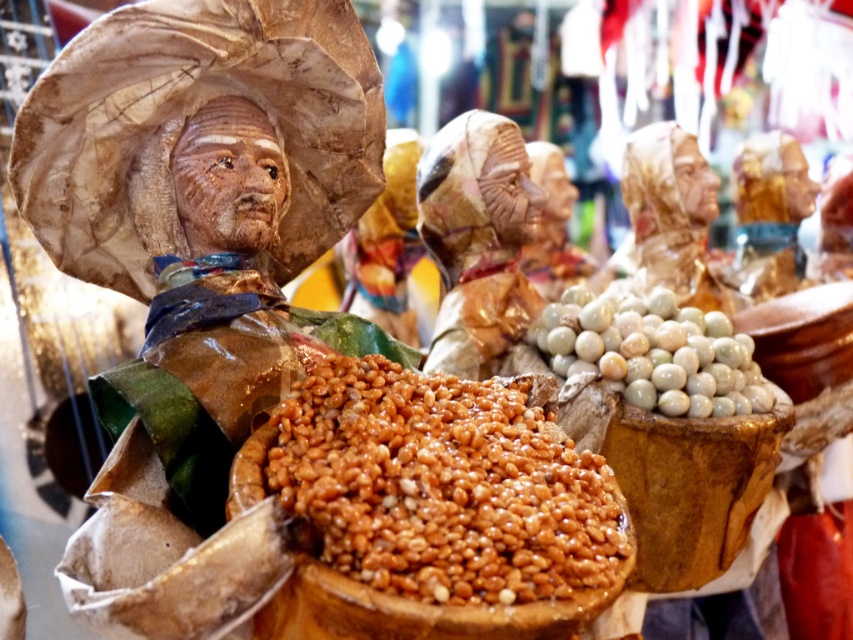
You are organizing a craft fair and have two items to display next to each other. You have a brown glossy grain at center and white marble beads at center. If you want to arrange them so that the larger item is on the left, which item should you place on the left?

The brown glossy grain at center is bigger than the white marble beads at center, so you should place the brown glossy grain at center on the left to have the larger item there.

You are standing in front of the vibrant display of traditional figurines. There is a point marked at coordinates (477, 237). What object is located at that point?

The point at coordinates (477, 237) is occupied by the matte brown statue at center.

You are standing in front of the display of traditional figurines. There are two points marked on the image. The first point is at coordinates point (323, 557) and the second point is at point (628, 332). Which point is closer to you?

Point (323, 557) is in front of point (628, 332), so it is closer to you.